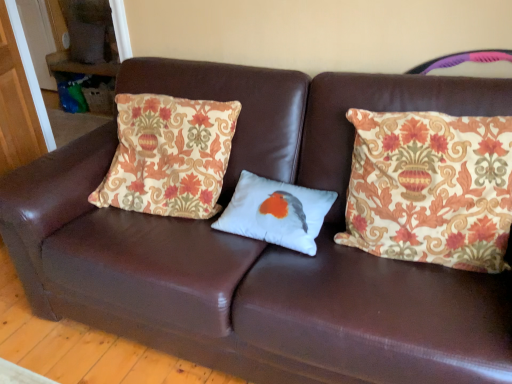
The image size is (512, 384). What are the coordinates of `floral-patterned fabric pillow at left, marked as the 3th pillow in a right-to-left arrangement` in the screenshot? It's located at (169, 156).

Where is `floral-patterned fabric pillow at left, marked as the 3th pillow in a right-to-left arrangement`? The image size is (512, 384). floral-patterned fabric pillow at left, marked as the 3th pillow in a right-to-left arrangement is located at coordinates (169, 156).

From a real-world perspective, is white matte pillow with bird design at center, marked as the second pillow in a right-to-left arrangement, below patterned fabric pillow at right, acting as the 1th pillow starting from the right?

Indeed, from a real-world perspective, white matte pillow with bird design at center, marked as the second pillow in a right-to-left arrangement, is positioned beneath patterned fabric pillow at right, acting as the 1th pillow starting from the right.

Which of these two, white matte pillow with bird design at center, positioned as the second pillow in left-to-right order, or patterned fabric pillow at right, positioned as the third pillow in left-to-right order, stands taller?

Standing taller between the two is patterned fabric pillow at right, positioned as the third pillow in left-to-right order.

Is white matte pillow with bird design at center, marked as the second pillow in a right-to-left arrangement, next to patterned fabric pillow at right, acting as the 1th pillow starting from the right?

white matte pillow with bird design at center, marked as the second pillow in a right-to-left arrangement, and patterned fabric pillow at right, acting as the 1th pillow starting from the right, are clearly separated.

Starting from the patterned fabric pillow at right, acting as the 1th pillow starting from the right, which pillow is the 2nd one behind? Please provide its 2D coordinates.

[(276, 212)]

How many degrees apart are the facing directions of patterned fabric pillow at right, acting as the 1th pillow starting from the right, and floral-patterned fabric pillow at left, marked as the 3th pillow in a right-to-left arrangement?

The angle between the facing direction of patterned fabric pillow at right, acting as the 1th pillow starting from the right, and the facing direction of floral-patterned fabric pillow at left, marked as the 3th pillow in a right-to-left arrangement, is 0.964 degrees.

Which is more to the left, patterned fabric pillow at right, acting as the 1th pillow starting from the right, or floral-patterned fabric pillow at left, marked as the 3th pillow in a right-to-left arrangement?

floral-patterned fabric pillow at left, marked as the 3th pillow in a right-to-left arrangement.

Starting from the floral-patterned fabric pillow at left, the 1th pillow when ordered from left to right, which pillow is the 2nd one to the right? Please provide its 2D coordinates.

[(431, 188)]

Which object is further away from the camera taking this photo, patterned fabric pillow at right, positioned as the third pillow in left-to-right order, or floral-patterned fabric pillow at left, marked as the 3th pillow in a right-to-left arrangement?

Positioned behind is floral-patterned fabric pillow at left, marked as the 3th pillow in a right-to-left arrangement.

Is point (410, 116) less distant than point (254, 233)?

Yes, point (410, 116) is in front of point (254, 233).

From a real-world perspective, does patterned fabric pillow at right, acting as the 1th pillow starting from the right, sit lower than white matte pillow with bird design at center, positioned as the second pillow in left-to-right order?

Actually, patterned fabric pillow at right, acting as the 1th pillow starting from the right, is physically above white matte pillow with bird design at center, positioned as the second pillow in left-to-right order, in the real world.

Is white matte pillow with bird design at center, marked as the second pillow in a right-to-left arrangement, at the back of patterned fabric pillow at right, acting as the 1th pillow starting from the right?

No, patterned fabric pillow at right, acting as the 1th pillow starting from the right, is not facing away from white matte pillow with bird design at center, marked as the second pillow in a right-to-left arrangement.

Looking at the image, does patterned fabric pillow at right, positioned as the third pillow in left-to-right order, seem bigger or smaller compared to white matte pillow with bird design at center, marked as the second pillow in a right-to-left arrangement?

patterned fabric pillow at right, positioned as the third pillow in left-to-right order, is bigger than white matte pillow with bird design at center, marked as the second pillow in a right-to-left arrangement.

Is floral-patterned fabric pillow at left, the 1th pillow when ordered from left to right, at the right side of white matte pillow with bird design at center, positioned as the second pillow in left-to-right order?

Incorrect, floral-patterned fabric pillow at left, the 1th pillow when ordered from left to right, is not on the right side of white matte pillow with bird design at center, positioned as the second pillow in left-to-right order.

From a real-world perspective, is floral-patterned fabric pillow at left, marked as the 3th pillow in a right-to-left arrangement, positioned over white matte pillow with bird design at center, marked as the second pillow in a right-to-left arrangement, based on gravity?

Indeed, from a real-world perspective, floral-patterned fabric pillow at left, marked as the 3th pillow in a right-to-left arrangement, stands above white matte pillow with bird design at center, marked as the second pillow in a right-to-left arrangement.

Which is closer, [161,167] or [301,243]?

Clearly, point [161,167] is more distant from the camera than point [301,243].

Who is smaller, white matte pillow with bird design at center, positioned as the second pillow in left-to-right order, or floral-patterned fabric pillow at left, the 1th pillow when ordered from left to right?

white matte pillow with bird design at center, positioned as the second pillow in left-to-right order.

Where is `pillow that is the 2nd one when counting upward from the white matte pillow with bird design at center, positioned as the second pillow in left-to-right order (from the image's perspective)`? pillow that is the 2nd one when counting upward from the white matte pillow with bird design at center, positioned as the second pillow in left-to-right order (from the image's perspective) is located at coordinates (169, 156).

Is white matte pillow with bird design at center, marked as the second pillow in a right-to-left arrangement, wider than floral-patterned fabric pillow at left, marked as the 3th pillow in a right-to-left arrangement?

In fact, white matte pillow with bird design at center, marked as the second pillow in a right-to-left arrangement, might be narrower than floral-patterned fabric pillow at left, marked as the 3th pillow in a right-to-left arrangement.

Is floral-patterned fabric pillow at left, the 1th pillow when ordered from left to right, completely or partially inside white matte pillow with bird design at center, marked as the second pillow in a right-to-left arrangement?

No, floral-patterned fabric pillow at left, the 1th pillow when ordered from left to right, is not inside white matte pillow with bird design at center, marked as the second pillow in a right-to-left arrangement.

From the image's perspective, between floral-patterned fabric pillow at left, marked as the 3th pillow in a right-to-left arrangement, and patterned fabric pillow at right, positioned as the third pillow in left-to-right order, which one is located above?

floral-patterned fabric pillow at left, marked as the 3th pillow in a right-to-left arrangement.

This screenshot has height=384, width=512. Identify the location of pillow that appears above the patterned fabric pillow at right, acting as the 1th pillow starting from the right (from the image's perspective). (169, 156).

Is patterned fabric pillow at right, positioned as the third pillow in left-to-right order, surrounded by floral-patterned fabric pillow at left, the 1th pillow when ordered from left to right?

That's incorrect, patterned fabric pillow at right, positioned as the third pillow in left-to-right order, is not inside floral-patterned fabric pillow at left, the 1th pillow when ordered from left to right.

Image resolution: width=512 pixels, height=384 pixels. What are the coordinates of `pillow that appears on the right of white matte pillow with bird design at center, positioned as the second pillow in left-to-right order` in the screenshot? It's located at (431, 188).

The width and height of the screenshot is (512, 384). I want to click on the 1st pillow behind the patterned fabric pillow at right, positioned as the third pillow in left-to-right order, so click(169, 156).

Based on their spatial positions, is white matte pillow with bird design at center, positioned as the second pillow in left-to-right order, or floral-patterned fabric pillow at left, marked as the 3th pillow in a right-to-left arrangement, further from patterned fabric pillow at right, positioned as the third pillow in left-to-right order?

floral-patterned fabric pillow at left, marked as the 3th pillow in a right-to-left arrangement.

Which object lies nearer to the anchor point floral-patterned fabric pillow at left, marked as the 3th pillow in a right-to-left arrangement, patterned fabric pillow at right, acting as the 1th pillow starting from the right, or white matte pillow with bird design at center, positioned as the second pillow in left-to-right order?

Among the two, white matte pillow with bird design at center, positioned as the second pillow in left-to-right order, is located nearer to floral-patterned fabric pillow at left, marked as the 3th pillow in a right-to-left arrangement.

Which object lies nearer to the anchor point patterned fabric pillow at right, positioned as the third pillow in left-to-right order, floral-patterned fabric pillow at left, marked as the 3th pillow in a right-to-left arrangement, or white matte pillow with bird design at center, positioned as the second pillow in left-to-right order?

Based on the image, white matte pillow with bird design at center, positioned as the second pillow in left-to-right order, appears to be nearer to patterned fabric pillow at right, positioned as the third pillow in left-to-right order.

Estimate the real-world distances between objects in this image. Which object is closer to white matte pillow with bird design at center, marked as the second pillow in a right-to-left arrangement, floral-patterned fabric pillow at left, marked as the 3th pillow in a right-to-left arrangement, or patterned fabric pillow at right, positioned as the third pillow in left-to-right order?

floral-patterned fabric pillow at left, marked as the 3th pillow in a right-to-left arrangement.

When comparing their distances from floral-patterned fabric pillow at left, marked as the 3th pillow in a right-to-left arrangement, does white matte pillow with bird design at center, positioned as the second pillow in left-to-right order, or patterned fabric pillow at right, positioned as the third pillow in left-to-right order, seem further?

patterned fabric pillow at right, positioned as the third pillow in left-to-right order, is positioned further to the anchor floral-patterned fabric pillow at left, marked as the 3th pillow in a right-to-left arrangement.

From the image, which object appears to be nearer to white matte pillow with bird design at center, marked as the second pillow in a right-to-left arrangement, patterned fabric pillow at right, acting as the 1th pillow starting from the right, or floral-patterned fabric pillow at left, the 1th pillow when ordered from left to right?

Based on the image, floral-patterned fabric pillow at left, the 1th pillow when ordered from left to right, appears to be nearer to white matte pillow with bird design at center, marked as the second pillow in a right-to-left arrangement.

Where is `pillow between floral-patterned fabric pillow at left, the 1th pillow when ordered from left to right, and patterned fabric pillow at right, positioned as the third pillow in left-to-right order, in the horizontal direction`? The width and height of the screenshot is (512, 384). pillow between floral-patterned fabric pillow at left, the 1th pillow when ordered from left to right, and patterned fabric pillow at right, positioned as the third pillow in left-to-right order, in the horizontal direction is located at coordinates (276, 212).